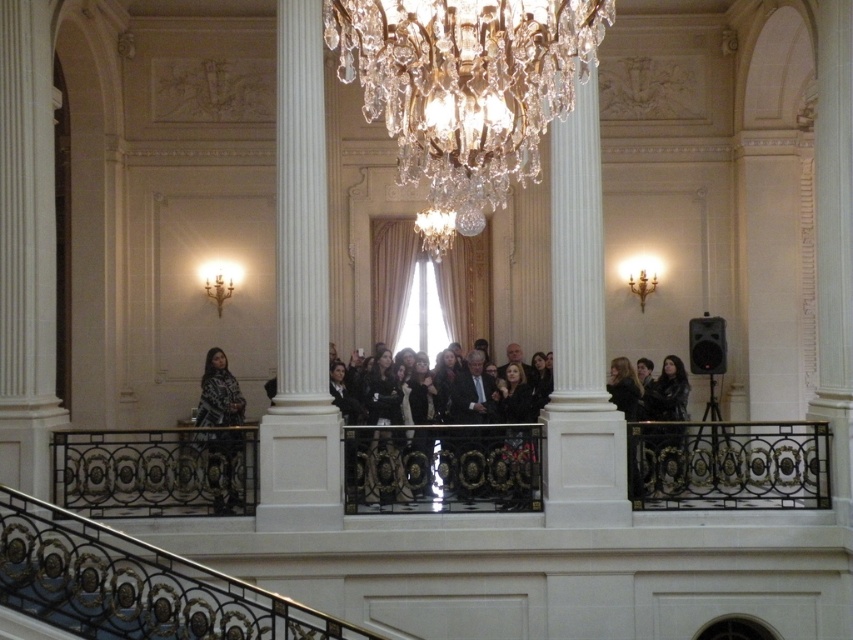
Question: Does white smooth column at center have a greater width compared to white marble column at center?

Choices:
 (A) yes
 (B) no

Answer: (A)

Question: Which of these objects is positioned farthest from the white marble column at center?

Choices:
 (A) crystal-golden chandelier at center
 (B) black leather jacket at center
 (C) white smooth column at center
 (D) patterned fabric shawl at upper left

Answer: (A)

Question: Among these points, which one is farthest from the camera?

Choices:
 (A) (363, 426)
 (B) (329, 460)

Answer: (A)

Question: Which of the following is the closest to the observer?

Choices:
 (A) white smooth column at center
 (B) patterned fabric shawl at upper left
 (C) black leather jacket at center
 (D) white marble column at center

Answer: (B)

Question: Is crystal-golden chandelier at center closer to camera compared to white smooth column at center?

Choices:
 (A) no
 (B) yes

Answer: (B)

Question: Can you confirm if white smooth column at center is positioned below patterned fabric shawl at upper left?

Choices:
 (A) no
 (B) yes

Answer: (A)